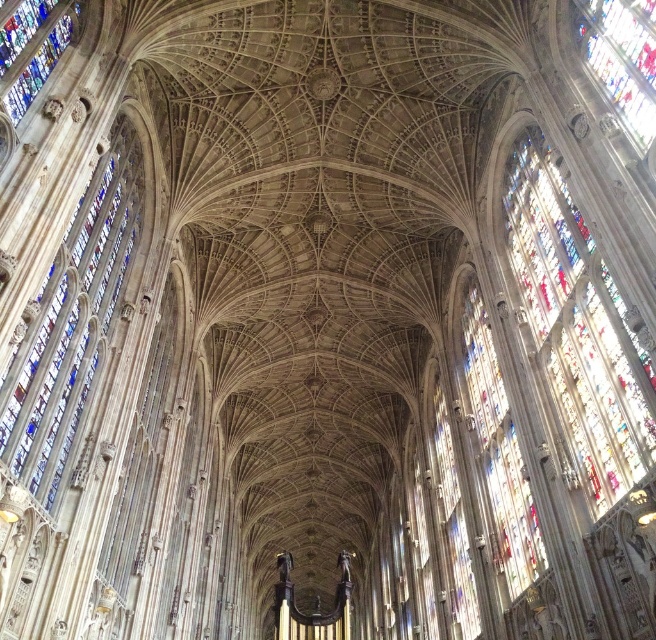
Between point (651, 440) and point (474, 634), which one is positioned behind?

The point (474, 634) is behind.

Consider the image. Does stained glass window at right have a greater width compared to transparent stained glass at right?

Answer: Indeed, stained glass window at right has a greater width compared to transparent stained glass at right.

Measure the distance between point (550, 278) and camera.

Point (550, 278) and camera are 67.26 meters apart.

This screenshot has height=640, width=656. I want to click on stained glass window at right, so click(x=575, y=326).

This screenshot has width=656, height=640. I want to click on stained glass window at upper right, so click(x=623, y=65).

Is stained glass window at upper right shorter than stained glass window at upper left?

In fact, stained glass window at upper right may be taller than stained glass window at upper left.

Which is in front, point (607, 28) or point (14, 54)?

Positioned in front is point (14, 54).

Locate an element on the screen. The image size is (656, 640). stained glass window at upper right is located at coordinates (623, 65).

What do you see at coordinates (31, 51) in the screenshot? This screenshot has height=640, width=656. I see `stained glass window at upper left` at bounding box center [31, 51].

The height and width of the screenshot is (640, 656). What do you see at coordinates (31, 51) in the screenshot? I see `stained glass window at upper left` at bounding box center [31, 51].

Where is `stained glass window at upper left`? Image resolution: width=656 pixels, height=640 pixels. stained glass window at upper left is located at coordinates (31, 51).